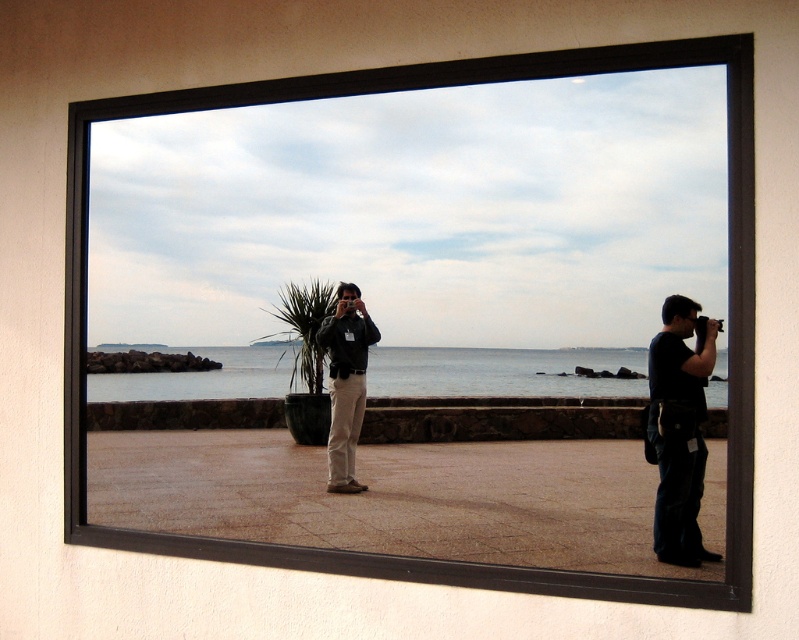
Does blue water at center come in front of black matte camera at right?

No, it is not.

Consider the image. Does blue water at center appear under black matte camera at right?

Actually, blue water at center is above black matte camera at right.

Where is `blue water at center`? The width and height of the screenshot is (799, 640). blue water at center is located at coordinates (499, 371).

Locate an element on the screen. The height and width of the screenshot is (640, 799). blue water at center is located at coordinates (499, 371).

Does black matte camera at right have a larger size compared to matte black jacket at center?

No, black matte camera at right is not bigger than matte black jacket at center.

Is point (678, 465) farther from viewer compared to point (344, 413)?

No, it is not.

Where is `black matte camera at right`? The height and width of the screenshot is (640, 799). black matte camera at right is located at coordinates (678, 428).

Who is more forward, [378,388] or [352,490]?

Point [378,388] is in front.

Is blue water at center further to camera compared to matte black jacket at center?

No, it is not.

Between point (613, 394) and point (344, 426), which one is positioned in front?

Point (613, 394) is more forward.

Where is `blue water at center`? blue water at center is located at coordinates (499, 371).